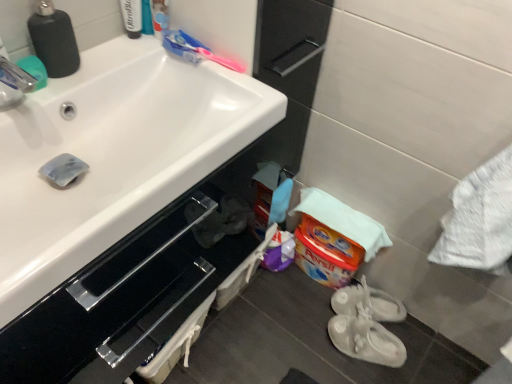
This screenshot has height=384, width=512. Identify the location of free space in front of pink plastic toothbrush at upper center. (222, 95).